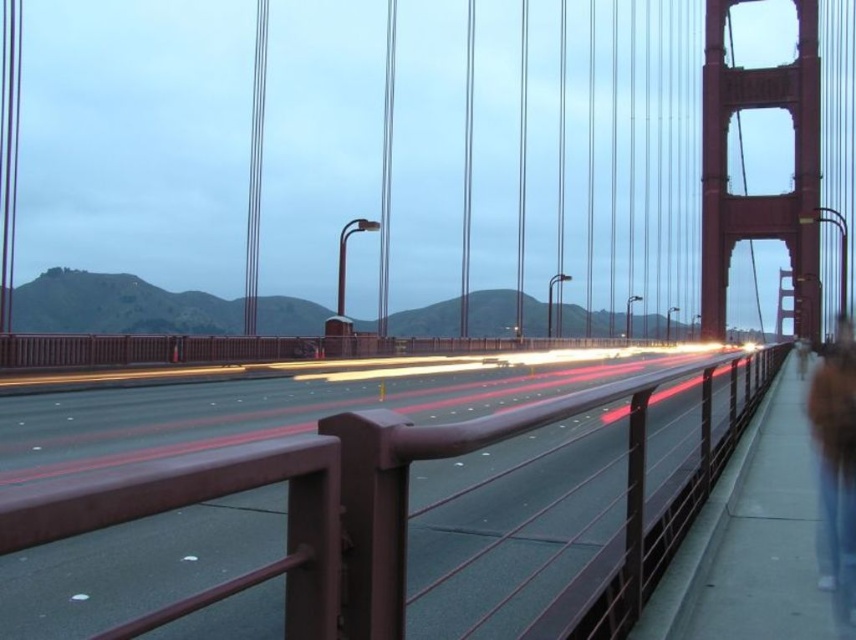
In the scene shown: You are standing on the Golden Gate Bridge and want to take a photo of the brown fur coat at right. To avoid the brown metal railing at center from blocking your view, should you crouch down or stand up taller?

The brown metal railing at center is taller than the brown fur coat at right, so you should crouch down to lower your viewpoint and avoid the railing blocking the fur coat in your photo.

You are a photographer standing on the Golden Gate Bridge. You want to place a small tripod between the brown metal railing at center and the brown fur coat at right. Can you fit the tripod there if the tripod requires 1 meter of space?

The brown metal railing at center is narrower than the brown fur coat at right. However, the exact width difference isn not provided. Without knowing the actual widths, it is impossible to determine if the tripod will fit. Please measure the space first.

You are standing on the Golden Gate Bridge and notice a brown fur coat at right and a brown metal railing at center. Which object is closer to the bottom edge of the image?

The brown metal railing at center is closer to the bottom edge of the image because it is positioned below the brown fur coat at right.